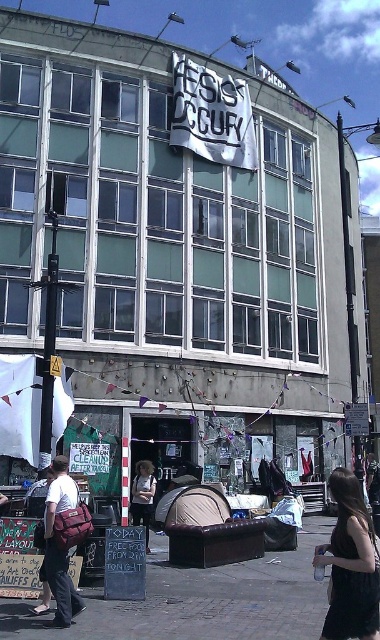
You are a delivery person trying to park your 1.8 meter wide van between the brick pavement at center and the white cotton shirt at center. Can you fit your van there?

The brick pavement at center is positioned under the white cotton shirt at center, which means there is no space between them for the van to park. Therefore, the van cannot fit between them.

You are organizing a clothing donation drive and have limited space in your van. You need to decide which item to take first between the black dress at lower right and the white cotton shirt at center. Based on their sizes, which one should you prioritize to maximize space efficiency?

The black dress at lower right is larger in size than the white cotton shirt at center, so you should prioritize taking the white cotton shirt at center first to maximize space efficiency by fitting more items.